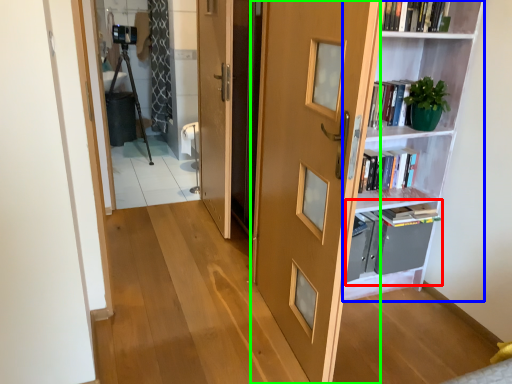
Question: Which object is positioned closest to cabinet (highlighted by a red box)? Select from shelf (highlighted by a blue box) and door (highlighted by a green box).

Choices:
 (A) shelf
 (B) door

Answer: (A)